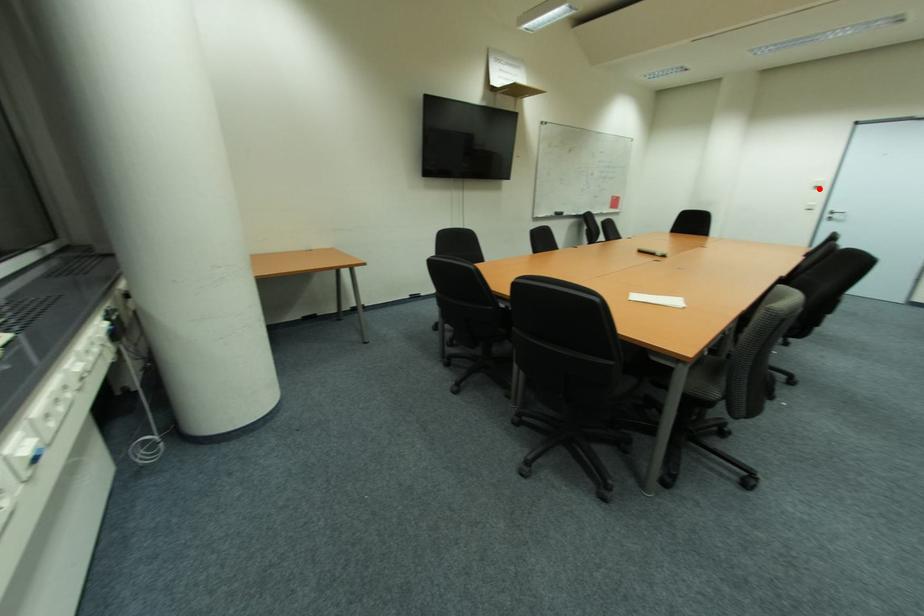
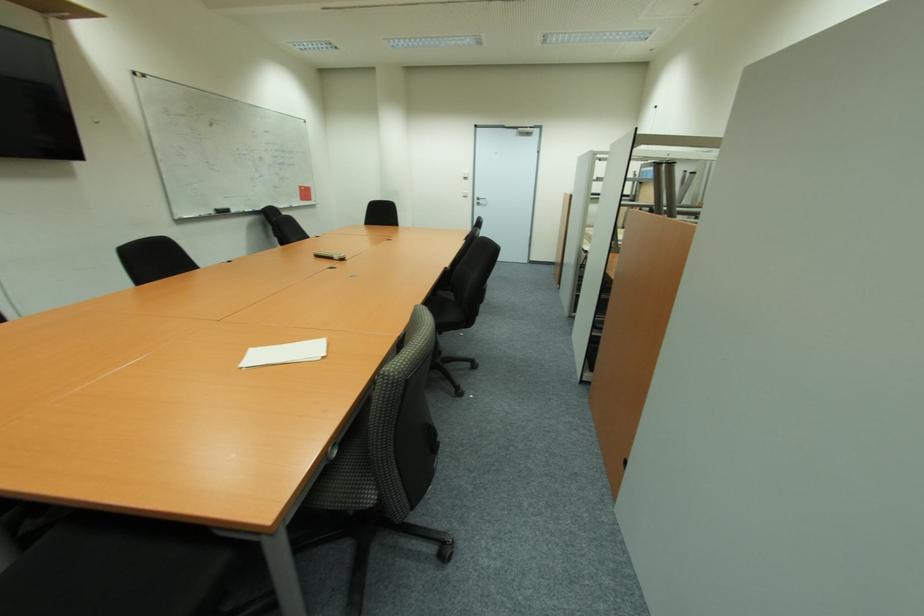
Question: A red point is marked in image1. In image2, is the corresponding 3D point closer to the camera or farther? Reply with the corresponding letter.

Choices:
 (A) The corresponding 3D point is closer.
 (B) The corresponding 3D point is farther.

Answer: (A)